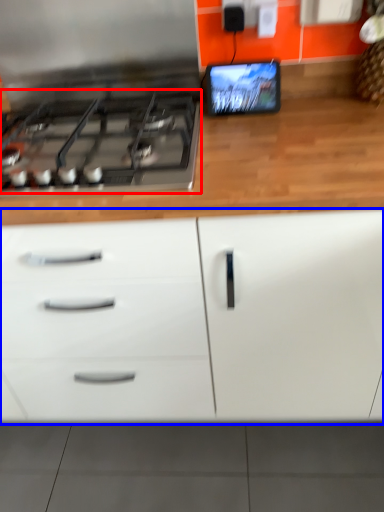
Question: Among these objects, which one is nearest to the camera, gas stove (highlighted by a red box) or cabinetry (highlighted by a blue box)?

Choices:
 (A) gas stove
 (B) cabinetry

Answer: (B)